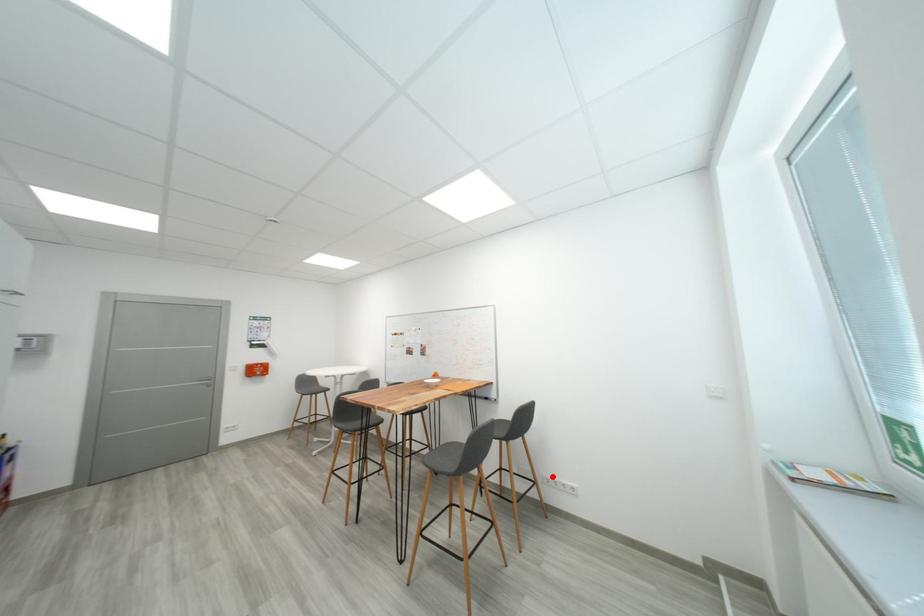
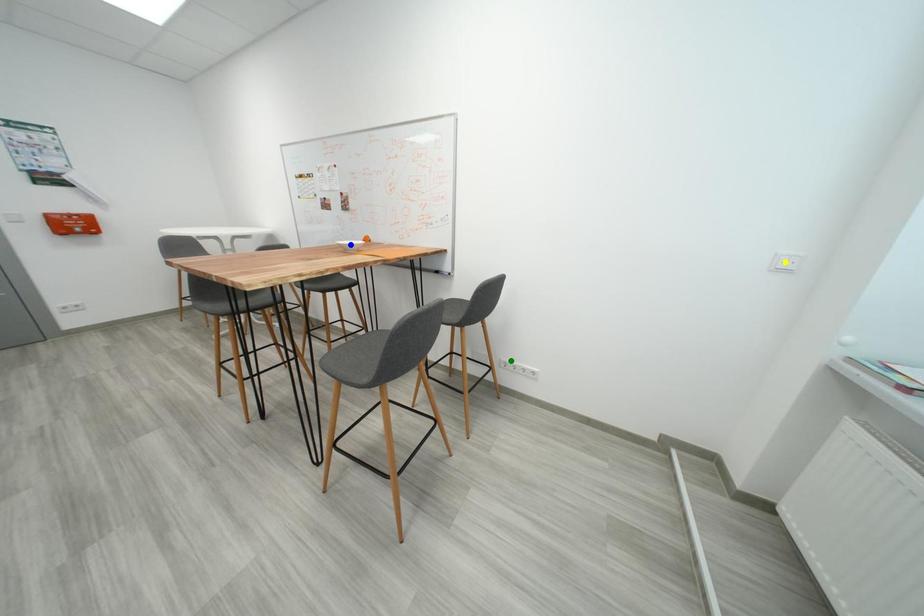
Question: I am providing you with two images of the same scene from different viewpoints. A red point is marked on the first image. You are given multiple points on the second image. Can you choose the point in image 2 that corresponds to the point in image 1?

Choices:
 (A) yellow point
 (B) blue point
 (C) green point

Answer: (C)